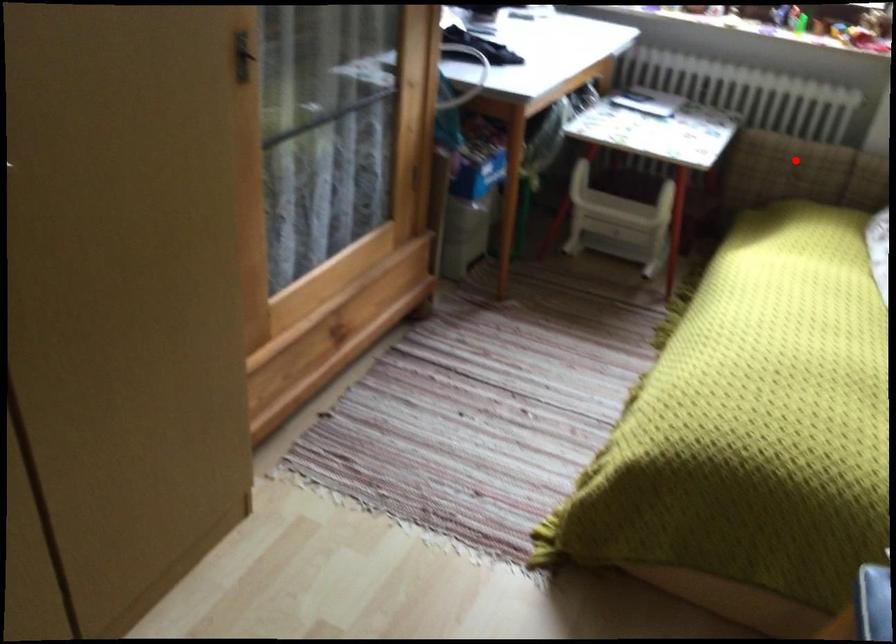
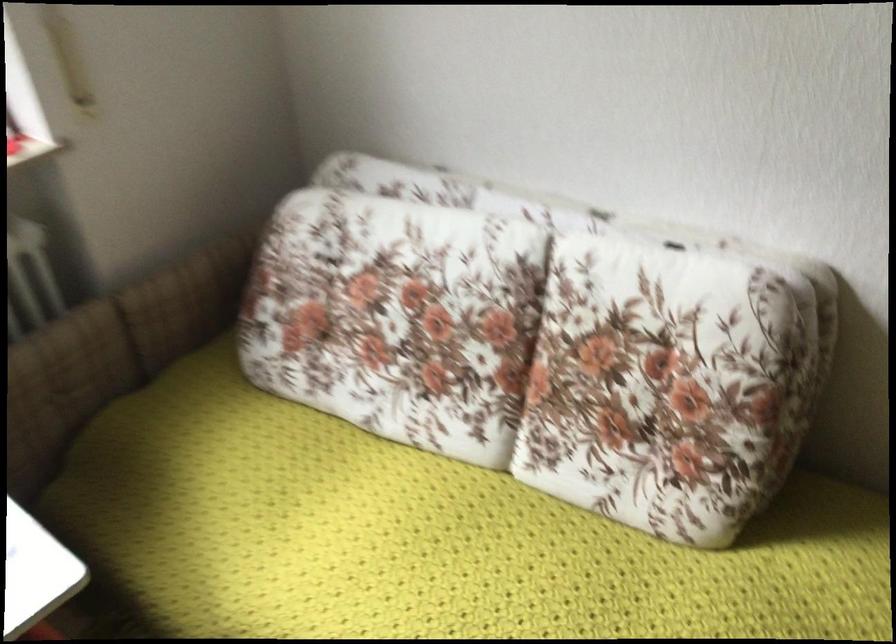
Question: I am providing you with two images of the same scene from different viewpoints. In image1, a red point is highlighted. Considering the same 3D point in image2, which of the following is correct?

Choices:
 (A) It is closer
 (B) It is farther

Answer: (A)